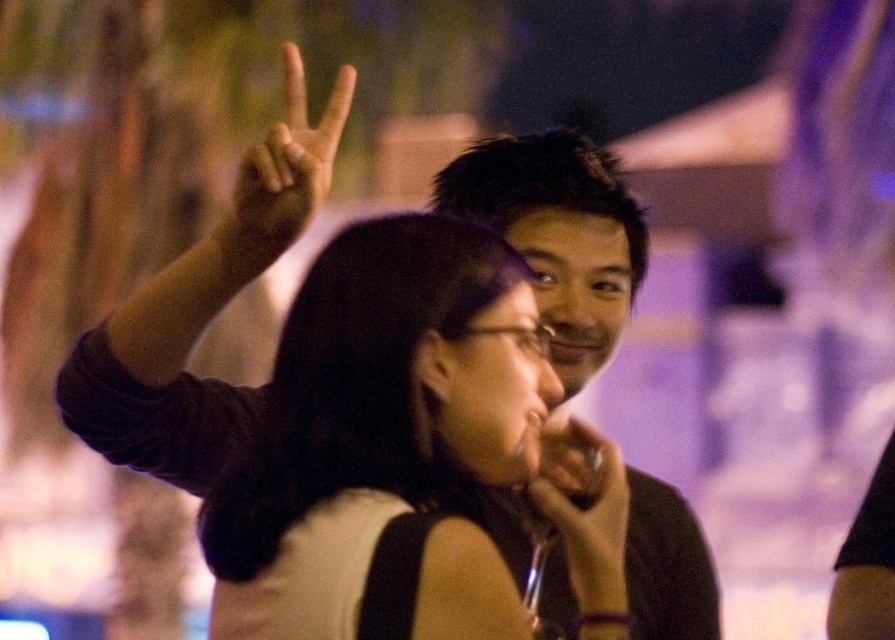
Question: Which of the following is the farthest from the observer?

Choices:
 (A) black matte hair at upper center
 (B) matte black hand at center
 (C) black matte hair at center
 (D) matte black hand at upper center

Answer: (C)

Question: Is matte black shirt at center closer to the viewer compared to matte black hand at upper center?

Choices:
 (A) yes
 (B) no

Answer: (B)

Question: Is black matte hair at center below matte black hand at center?

Choices:
 (A) no
 (B) yes

Answer: (A)

Question: Is black matte hair at upper center further to camera compared to matte black hand at center?

Choices:
 (A) yes
 (B) no

Answer: (B)

Question: Which of these objects is positioned farthest from the black matte hair at upper center?

Choices:
 (A) matte black hand at upper center
 (B) matte black hand at center

Answer: (B)

Question: Among these objects, which one is nearest to the camera?

Choices:
 (A) matte black hand at center
 (B) black matte hair at center
 (C) black matte hair at upper center

Answer: (C)